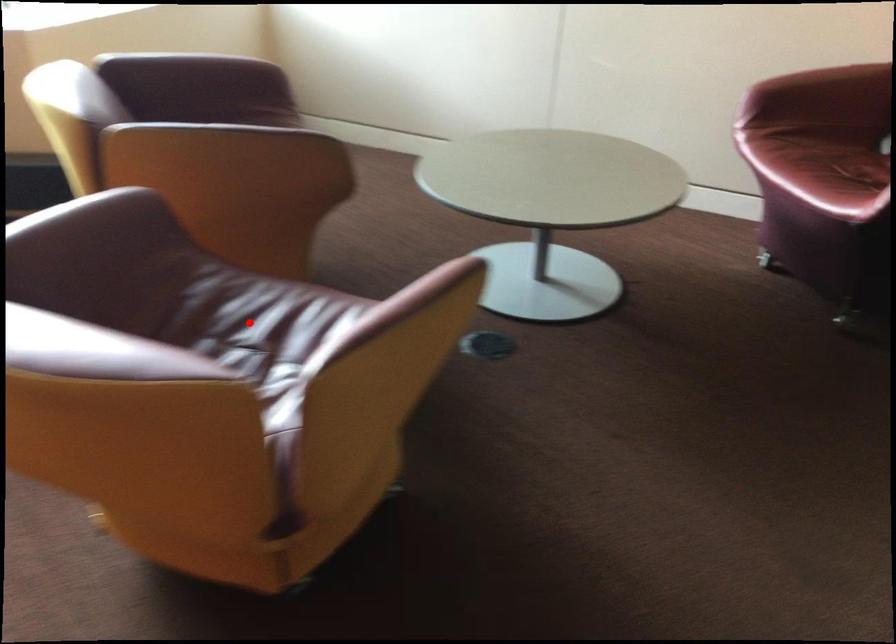
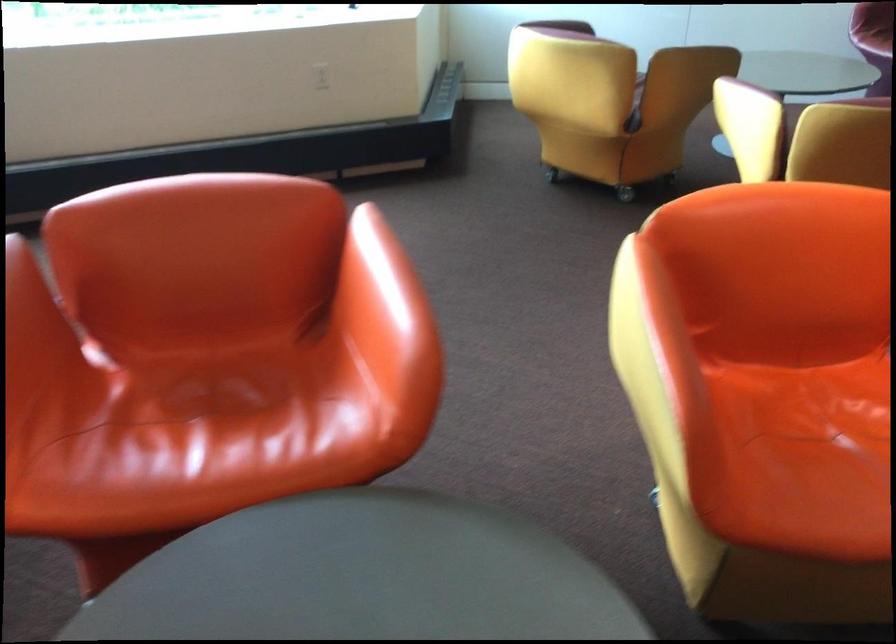
Question: I am providing you with two images of the same scene from different viewpoints. A red point is marked on the first image. Is the red point's position out of view in image 2?

Choices:
 (A) Yes
 (B) No

Answer: (A)